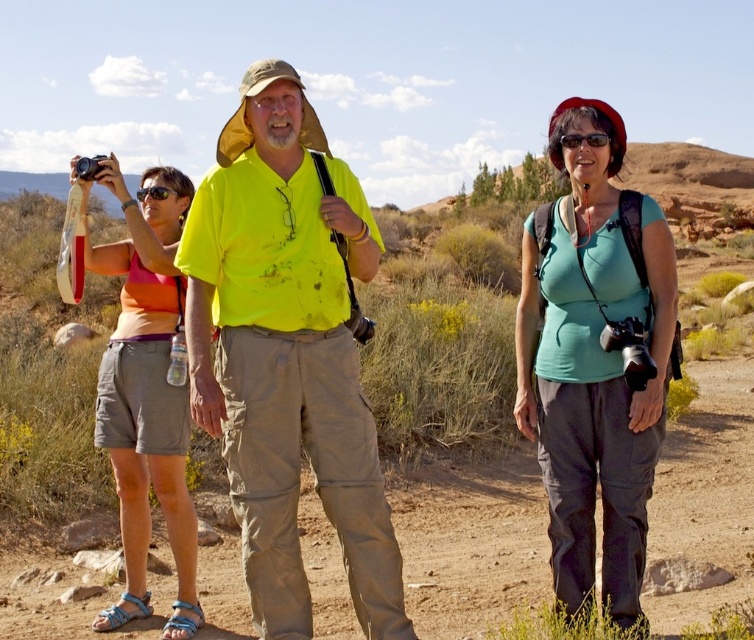
Question: Does teal fabric shirt at center appear on the right side of black plastic sunglasses at center?

Choices:
 (A) no
 (B) yes

Answer: (B)

Question: Can you confirm if orange fabric tank top at left is positioned below black plastic sunglasses at center?

Choices:
 (A) yes
 (B) no

Answer: (A)

Question: Can you confirm if yellow matte shirt at center is positioned to the left of orange fabric tank top at left?

Choices:
 (A) yes
 (B) no

Answer: (B)

Question: Estimate the real-world distances between objects in this image. Which object is farther from the teal fabric shirt at center?

Choices:
 (A) yellow matte shirt at center
 (B) black plastic sunglasses at center

Answer: (B)

Question: Which object appears farthest from the camera in this image?

Choices:
 (A) yellow matte shirt at center
 (B) black plastic sunglasses at center
 (C) teal fabric shirt at center
 (D) orange fabric tank top at left

Answer: (B)

Question: Among these objects, which one is nearest to the camera?

Choices:
 (A) yellow matte shirt at center
 (B) orange fabric tank top at left
 (C) teal fabric shirt at center

Answer: (A)